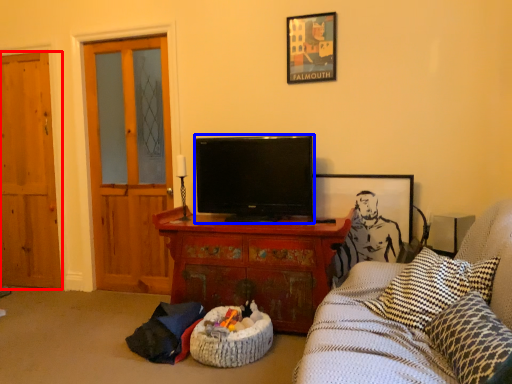
Question: Among these objects, which one is farthest to the camera, door (highlighted by a red box) or television (highlighted by a blue box)?

Choices:
 (A) door
 (B) television

Answer: (A)